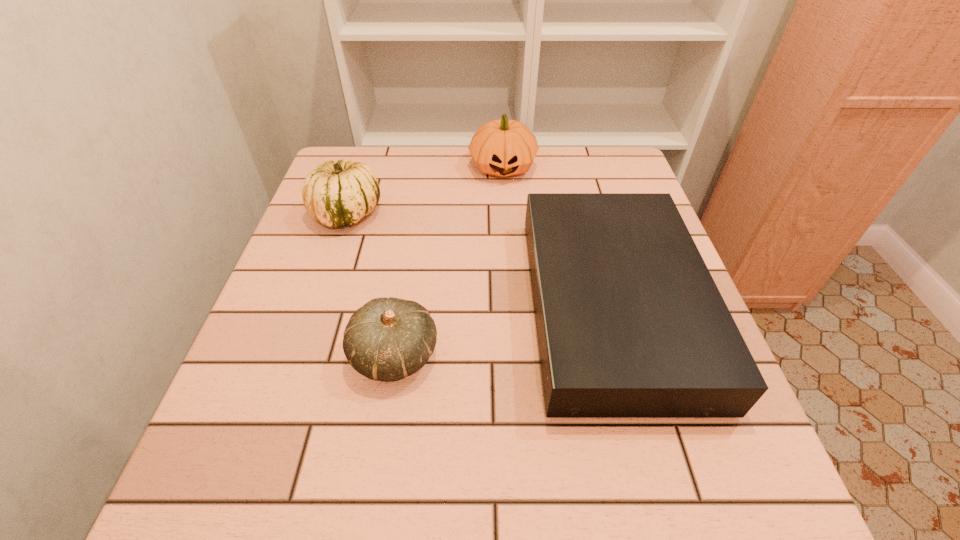
You are a GUI agent. You are given a task and a screenshot of the screen. Output one action in this format:
    pyautogui.click(x=<x>, y=<y>)
    Task: Click on the free space located 0.300m at the front of the shortest object for disc insertion
    
    Given the screenshot: What is the action you would take?
    (x=383, y=306)

Locate an element on the screen. vacant region located at the front of the shortest object for disc insertion is located at coordinates (468, 306).

The height and width of the screenshot is (540, 960). Identify the location of free spot located at the front of the shortest object for disc insertion. (343, 306).

I want to click on object that is at the left edge, so click(336, 194).

I want to click on object positioned at the right edge, so click(630, 324).

Where is `object that is at the far left corner`? Image resolution: width=960 pixels, height=540 pixels. object that is at the far left corner is located at coordinates (336, 194).

In the image, there is a desktop. Identify the location of vacant space at the far edge. This screenshot has width=960, height=540. (404, 168).

In the image, there is a desktop. Identify the location of vacant region at the near edge. 335,458.

Locate an element on the screen. free location at the left edge of the desktop is located at coordinates (343, 252).

Locate an element on the screen. Image resolution: width=960 pixels, height=540 pixels. vacant space at the far left corner is located at coordinates (375, 148).